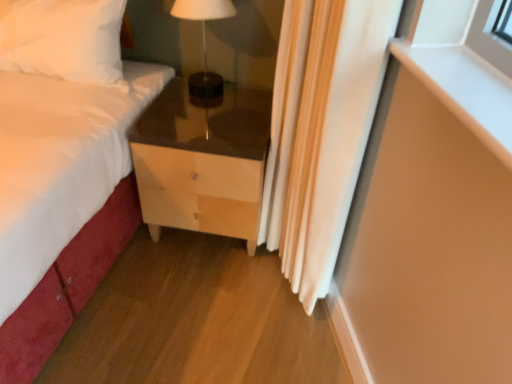
Locate an element on the screen. Image resolution: width=512 pixels, height=384 pixels. free space between matte wood chest of drawers at lower center and white fabric curtain at right is located at coordinates (218, 279).